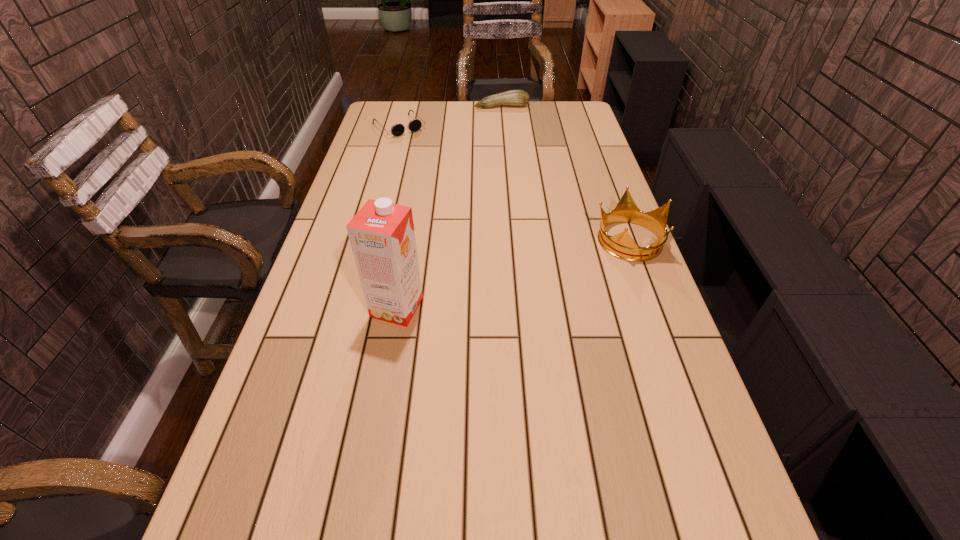
The image size is (960, 540). Find the location of `free space on the desktop that is between the nearest object and the second nearest object and is positioned on the front-facing side of the third nearest object`. free space on the desktop that is between the nearest object and the second nearest object and is positioned on the front-facing side of the third nearest object is located at coordinates (541, 265).

Locate an element on the screen. free space on the desktop that is between the nearest object and the rightmost object and is positioned at the stem end of the third object from left to right is located at coordinates (554, 261).